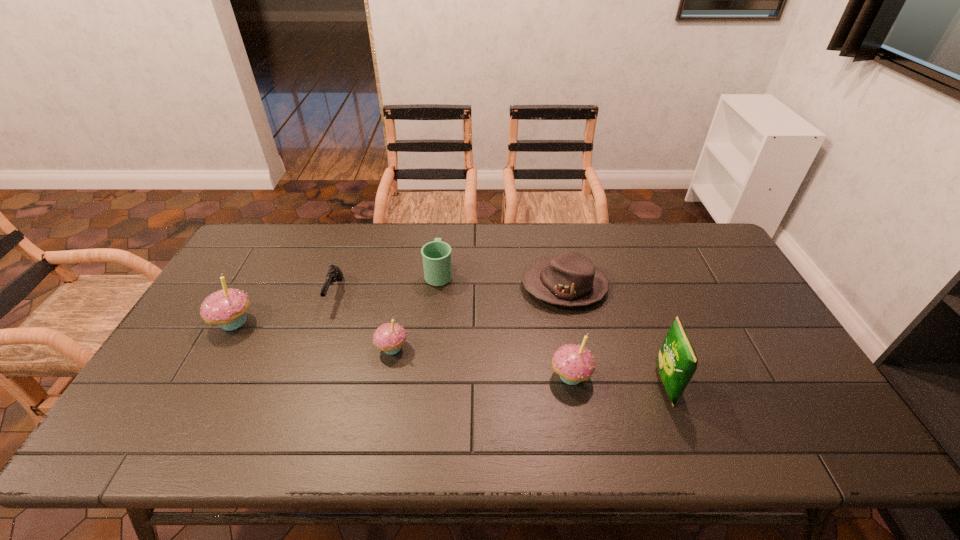
The height and width of the screenshot is (540, 960). Find the location of `the leftmost cupcake`. the leftmost cupcake is located at coordinates (227, 308).

I want to click on the shortest cupcake, so click(389, 337).

You are a GUI agent. You are given a task and a screenshot of the screen. Output one action in this format:
    pyautogui.click(x=<x>, y=<y>)
    Task: Click on the fifth object from right to left
    
    Given the screenshot: What is the action you would take?
    pyautogui.click(x=389, y=337)

You are a GUI agent. You are given a task and a screenshot of the screen. Output one action in this format:
    pyautogui.click(x=<x>, y=<y>)
    Task: Click on the rightmost cupcake
    The width and height of the screenshot is (960, 540).
    Given the screenshot: What is the action you would take?
    pyautogui.click(x=573, y=363)

Identify the location of the second tallest cupcake. Image resolution: width=960 pixels, height=540 pixels. (573, 363).

Locate an element on the screen. The image size is (960, 540). the shortest object is located at coordinates (334, 274).

Where is `gun`? gun is located at coordinates (334, 274).

Where is `the fourth object from left to right`? The image size is (960, 540). the fourth object from left to right is located at coordinates (436, 255).

Where is `hat`? hat is located at coordinates pos(570,279).

Where is `crisp (potato chip)`? Image resolution: width=960 pixels, height=540 pixels. crisp (potato chip) is located at coordinates (677, 361).